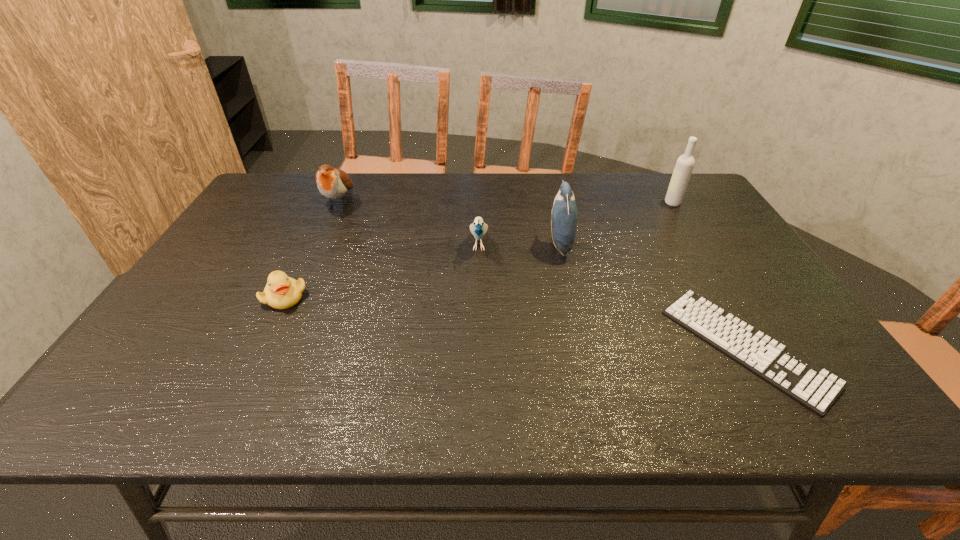
Identify the location of free space located at the tip of the third object from right to left's beak. (492, 245).

Identify the location of vacant space located at the face of the leftmost bird. This screenshot has width=960, height=540. [317, 253].

At what (x,y) coordinates should I click in order to perform the action: click on vacant space located at the face of the third shortest object. Please return your answer as a coordinate pair (x, y). This screenshot has width=960, height=540. Looking at the image, I should click on (479, 287).

This screenshot has height=540, width=960. I want to click on free point located 0.290m on the beak of the second shortest object, so click(227, 417).

The image size is (960, 540). I want to click on free region located 0.060m on the back of the computer keyboard, so click(x=706, y=279).

Where is `vodka positioned at the far edge`? vodka positioned at the far edge is located at coordinates (684, 166).

Image resolution: width=960 pixels, height=540 pixels. I want to click on bird that is at the far edge, so click(x=333, y=183).

The image size is (960, 540). I want to click on object situated at the near edge, so click(x=815, y=388).

Locate an element on the screen. The width and height of the screenshot is (960, 540). vodka that is at the right edge is located at coordinates (684, 166).

This screenshot has height=540, width=960. I want to click on computer keyboard that is at the right edge, so click(x=815, y=388).